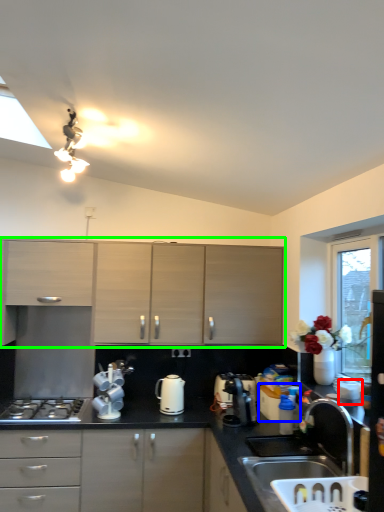
Question: Which object is positioned farthest from appliance (highlighted by a red box)? Select from appliance (highlighted by a blue box) and cabinetry (highlighted by a green box).

Choices:
 (A) appliance
 (B) cabinetry

Answer: (B)